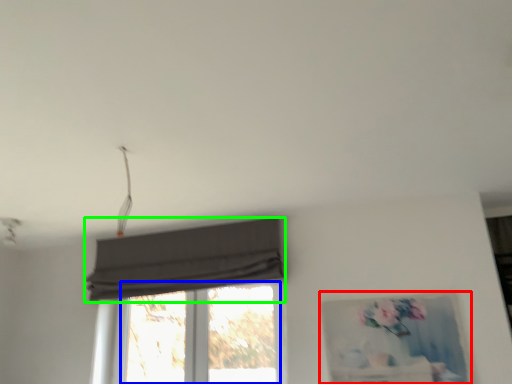
Question: Considering the real-world distances, which object is closest to picture frame (highlighted by a red box)? window (highlighted by a blue box) or curtain (highlighted by a green box).

Choices:
 (A) window
 (B) curtain

Answer: (A)